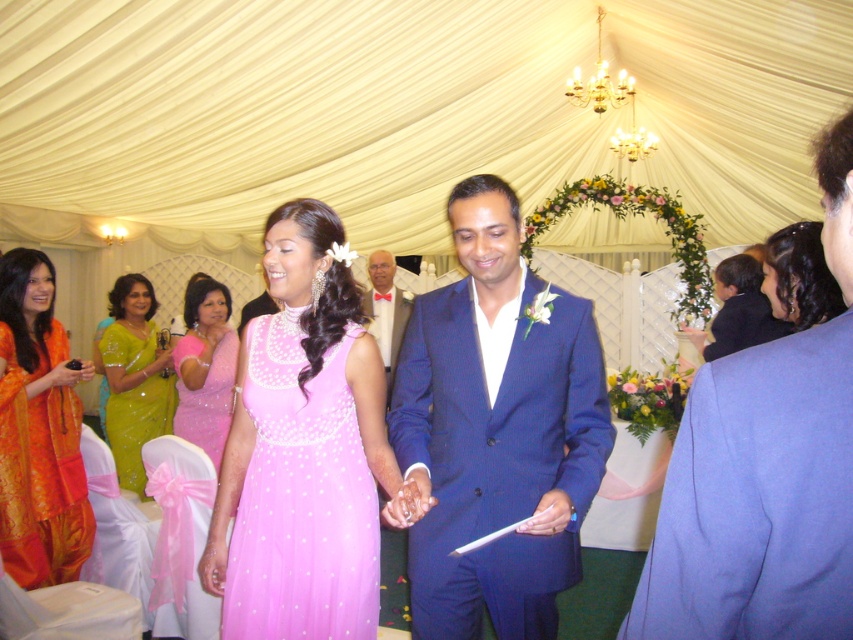
Which of these two, matte tulle dress at center or dark brown hair at upper right, stands shorter?

dark brown hair at upper right is shorter.

Is point (346, 570) farther from viewer compared to point (811, 307)?

No, (346, 570) is closer to viewer.

Find the location of a particular element. The width and height of the screenshot is (853, 640). matte tulle dress at center is located at coordinates (300, 497).

Looking at this image, between dark brown hair at upper right and matte bow tie at center, which one has less height?

With less height is dark brown hair at upper right.

Can you confirm if dark brown hair at upper right is positioned below matte bow tie at center?

No, dark brown hair at upper right is not below matte bow tie at center.

Identify the location of dark brown hair at upper right. This screenshot has height=640, width=853. (799, 276).

Does blue wool suit at center appear on the left side of matte bow tie at center?

In fact, blue wool suit at center is to the right of matte bow tie at center.

Between point (556, 618) and point (392, 298), which one is positioned in front?

Point (556, 618)

Does point (548, 355) lie in front of point (373, 305)?

Yes, point (548, 355) is in front of point (373, 305).

Where is `blue wool suit at center`? The width and height of the screenshot is (853, 640). blue wool suit at center is located at coordinates (496, 429).